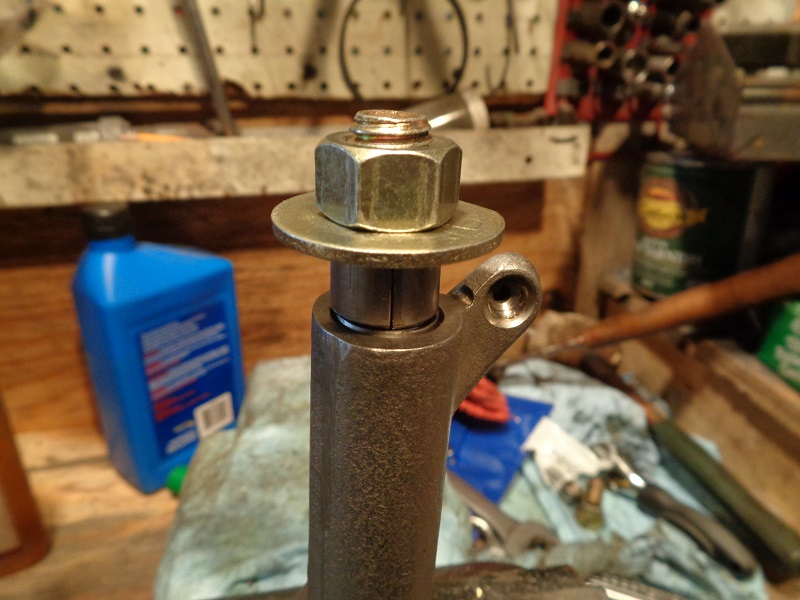
In order to click on wood handle in this screenshot , I will do `click(710, 300)`.